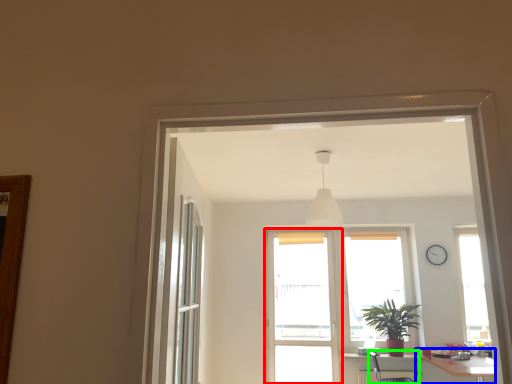
Question: Which object is positioned farthest from screen door (highlighted by a red box)? Select from table (highlighted by a blue box) and armchair (highlighted by a green box).

Choices:
 (A) table
 (B) armchair

Answer: (A)